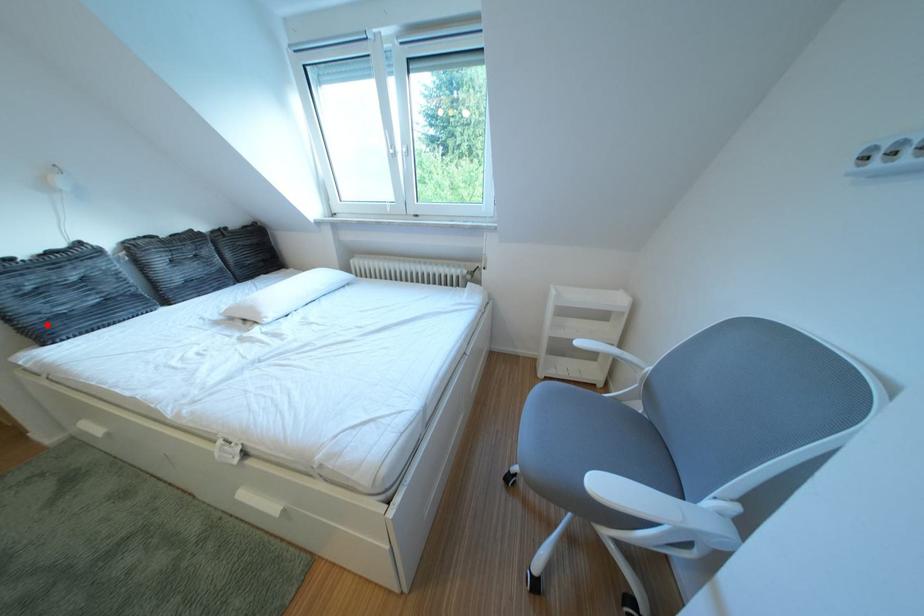
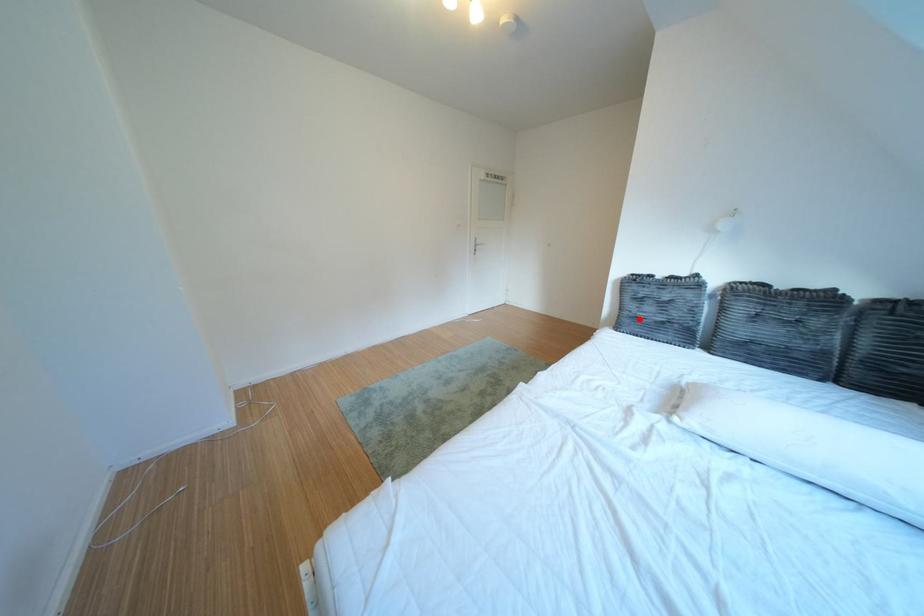
I am providing you with two images of the same scene from different viewpoints. A red point is marked on the first image and another point is marked on the second image. Do the highlighted points in image1 and image2 indicate the same real-world spot?

Yes